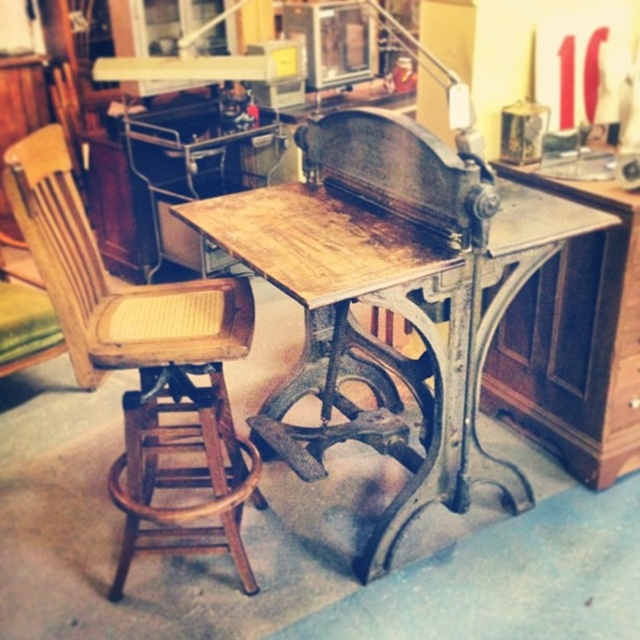
Question: Estimate the real-world distances between objects in this image. Which object is closer to the wooden drawer at center?

Choices:
 (A) wooden table at center
 (B) wooden cane seat at left

Answer: (A)

Question: Is wooden cane seat at left positioned at the back of wooden drawer at center?

Choices:
 (A) yes
 (B) no

Answer: (B)

Question: Does wooden table at center have a lesser width compared to wooden cane seat at left?

Choices:
 (A) yes
 (B) no

Answer: (B)

Question: Considering the real-world distances, which object is farthest from the wooden table at center?

Choices:
 (A) wooden cane seat at left
 (B) wooden drawer at center

Answer: (B)

Question: Which point is closer to the camera?

Choices:
 (A) (605, 433)
 (B) (273, 416)

Answer: (A)

Question: Can you confirm if wooden table at center is positioned below wooden drawer at center?

Choices:
 (A) no
 (B) yes

Answer: (A)